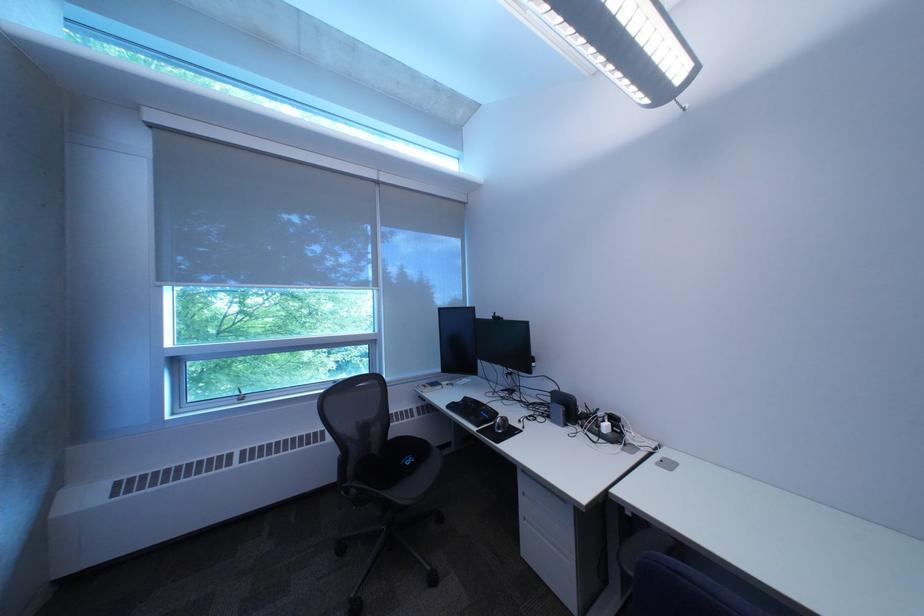
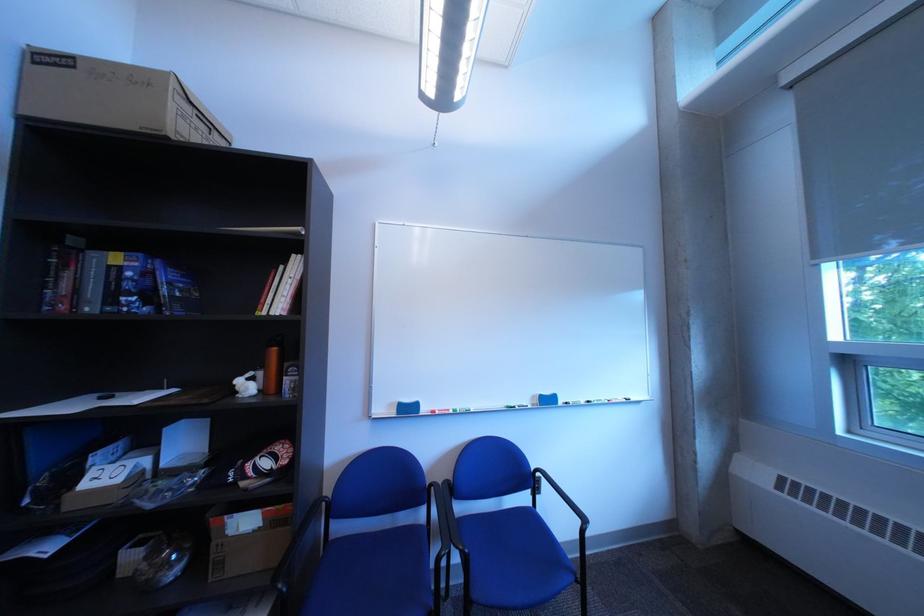
Question: The camera is either moving clockwise (left) or counter-clockwise (right) around the object. The first image is from the beginning of the video and the second image is from the end. Is the camera moving left or right when shooting the video?

Choices:
 (A) Left
 (B) Right

Answer: (B)